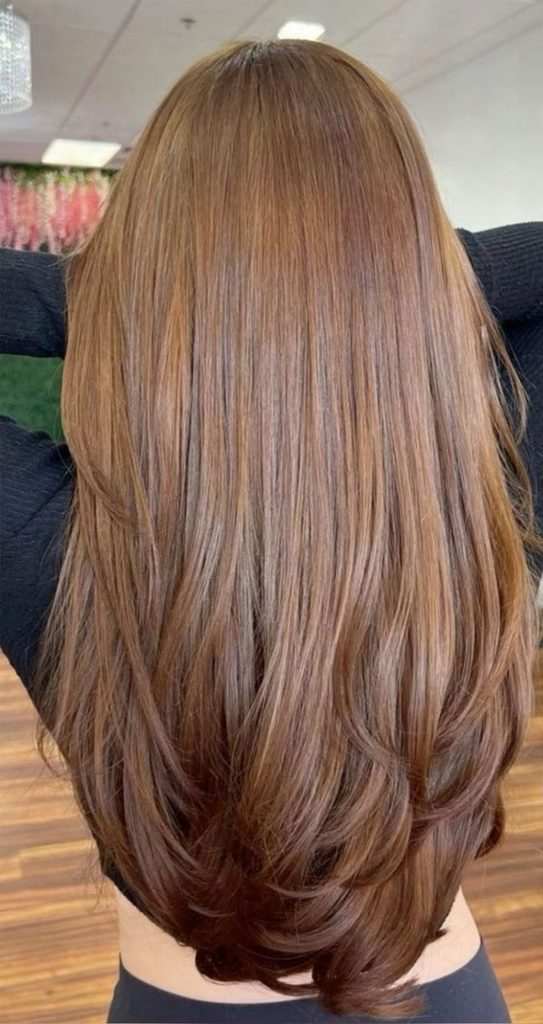
Identify the location of gray metallic fire suppression sprinkler. The height and width of the screenshot is (1024, 543). (187, 22).